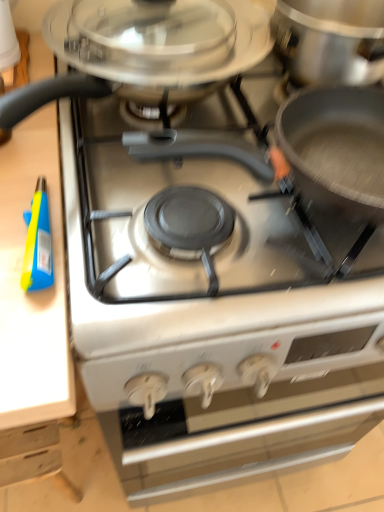
Measure the distance between satin silver cooktop at center and camera.

satin silver cooktop at center is 14.56 inches away from camera.

Describe the element at coordinates (242, 432) in the screenshot. I see `white matte oven at center` at that location.

Identify the location of satin silver cooktop at center. (145, 47).

Is there a large distance between blue plastic spray bottle at left and satin silver cooktop at center?

No.

From the image's perspective, is blue plastic spray bottle at left above or below satin silver cooktop at center?

Clearly, from the image's perspective, blue plastic spray bottle at left is below satin silver cooktop at center.

Is blue plastic spray bottle at left behind satin silver cooktop at center?

That is True.

Who is bigger, blue plastic spray bottle at left or satin silver cooktop at center?

satin silver cooktop at center is bigger.

In the image, is satin silver cooktop at center positioned in front of or behind white matte oven at center?

Clearly, satin silver cooktop at center is in front of white matte oven at center.

Does satin silver cooktop at center have a smaller size compared to white matte oven at center?

Correct, satin silver cooktop at center occupies less space than white matte oven at center.

Is satin silver cooktop at center directly adjacent to white matte oven at center?

satin silver cooktop at center and white matte oven at center are not in contact.

Consider the image. Is blue plastic spray bottle at left taller than white matte oven at center?

No, blue plastic spray bottle at left is not taller than white matte oven at center.

Considering the positions of points (46, 281) and (278, 465), is point (46, 281) closer to camera compared to point (278, 465)?

Yes, point (46, 281) is in front of point (278, 465).

How many degrees apart are the facing directions of blue plastic spray bottle at left and white matte oven at center?

The angle between the facing direction of blue plastic spray bottle at left and the facing direction of white matte oven at center is 0.472 degrees.

Which is in front, white matte oven at center or satin silver cooktop at center?

satin silver cooktop at center is more forward.

Where is `kitchen appliance that appears on the left of white matte oven at center`? kitchen appliance that appears on the left of white matte oven at center is located at coordinates (145, 47).

Are white matte oven at center and satin silver cooktop at center making contact?

They are not placed beside each other.

How many degrees apart are the facing directions of white matte oven at center and satin silver cooktop at center?

The angular difference between white matte oven at center and satin silver cooktop at center is 0.000688 degrees.

Do you think white matte oven at center is within blue plastic spray bottle at left, or outside of it?

white matte oven at center is spatially situated outside blue plastic spray bottle at left.

Is white matte oven at center shorter than blue plastic spray bottle at left?

In fact, white matte oven at center may be taller than blue plastic spray bottle at left.

Is satin silver cooktop at center oriented towards blue plastic spray bottle at left?

No, satin silver cooktop at center is not oriented towards blue plastic spray bottle at left.

Can you see satin silver cooktop at center touching blue plastic spray bottle at left?

No, satin silver cooktop at center is not in contact with blue plastic spray bottle at left.

Considering the sizes of satin silver cooktop at center and blue plastic spray bottle at left in the image, is satin silver cooktop at center wider or thinner than blue plastic spray bottle at left?

In the image, satin silver cooktop at center appears to be wider than blue plastic spray bottle at left.

At what (x,y) coordinates should I click in order to perform the action: click on appliance behind the satin silver cooktop at center. Please return your answer as a coordinate pair (x, y). Looking at the image, I should click on (38, 243).

At what (x,y) coordinates should I click in order to perform the action: click on appliance that appears behind the satin silver cooktop at center. Please return your answer as a coordinate pair (x, y). Looking at the image, I should click on (38, 243).

This screenshot has width=384, height=512. In order to click on oven below the satin silver cooktop at center (from the image's perspective) in this screenshot , I will do `click(242, 432)`.

Considering their positions, is satin silver cooktop at center positioned further to blue plastic spray bottle at left than white matte oven at center?

white matte oven at center is positioned further to the anchor blue plastic spray bottle at left.

Considering their positions, is satin silver cooktop at center positioned further to white matte oven at center than blue plastic spray bottle at left?

Among the two, blue plastic spray bottle at left is located further to white matte oven at center.

Considering their positions, is blue plastic spray bottle at left positioned further to white matte oven at center than satin silver cooktop at center?

Among the two, blue plastic spray bottle at left is located further to white matte oven at center.

When comparing their distances from satin silver cooktop at center, does white matte oven at center or blue plastic spray bottle at left seem further?

white matte oven at center is further to satin silver cooktop at center.

When comparing their distances from satin silver cooktop at center, does blue plastic spray bottle at left or white matte oven at center seem further?

white matte oven at center is further to satin silver cooktop at center.

Based on their spatial positions, is white matte oven at center or satin silver cooktop at center further from blue plastic spray bottle at left?

white matte oven at center is positioned further to the anchor blue plastic spray bottle at left.

Where is `appliance that lies between satin silver cooktop at center and white matte oven at center from top to bottom`? This screenshot has height=512, width=384. appliance that lies between satin silver cooktop at center and white matte oven at center from top to bottom is located at coordinates (38, 243).